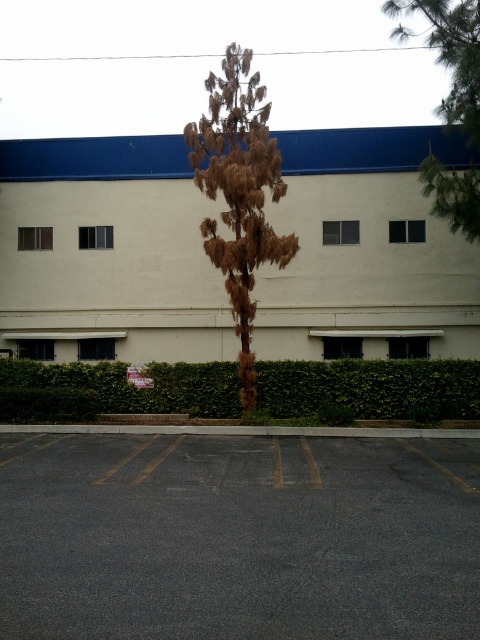
Question: Is gray asphalt parking lot at lower center below brown textured tree at upper right?

Choices:
 (A) no
 (B) yes

Answer: (B)

Question: Which point is closer to the camera taking this photo?

Choices:
 (A) tap(231, 164)
 (B) tap(83, 522)

Answer: (B)

Question: From the image, what is the correct spatial relationship of brown textured tree at center in relation to brown textured tree at upper right?

Choices:
 (A) right
 (B) left

Answer: (B)

Question: Which point appears closest to the camera in this image?

Choices:
 (A) (429, 154)
 (B) (129, 401)

Answer: (B)

Question: Does green leafy hedge at lower center come in front of brown textured tree at center?

Choices:
 (A) no
 (B) yes

Answer: (A)

Question: Which object is farther from the camera taking this photo?

Choices:
 (A) brown textured tree at upper right
 (B) gray asphalt parking lot at lower center
 (C) brown textured tree at center
 (D) green leafy hedge at lower center

Answer: (D)